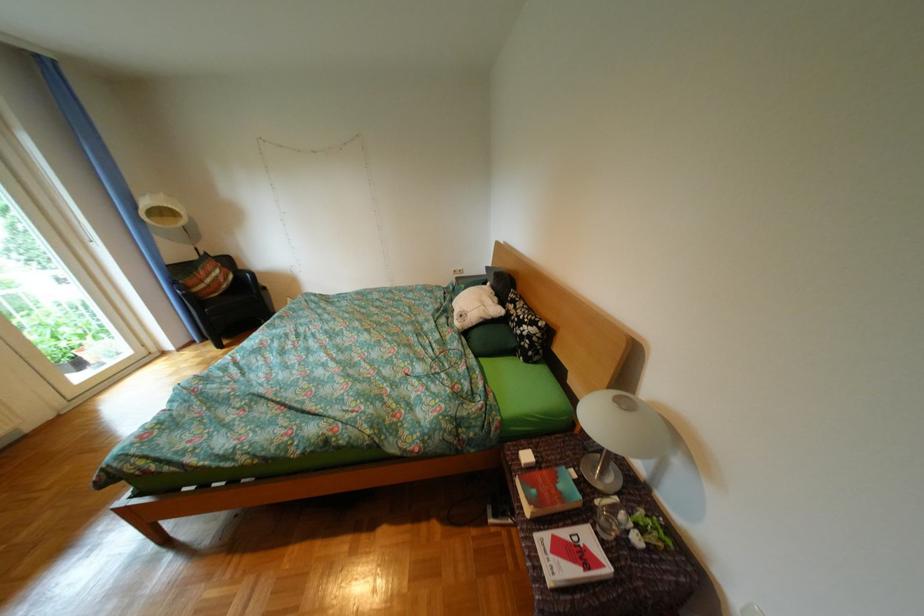
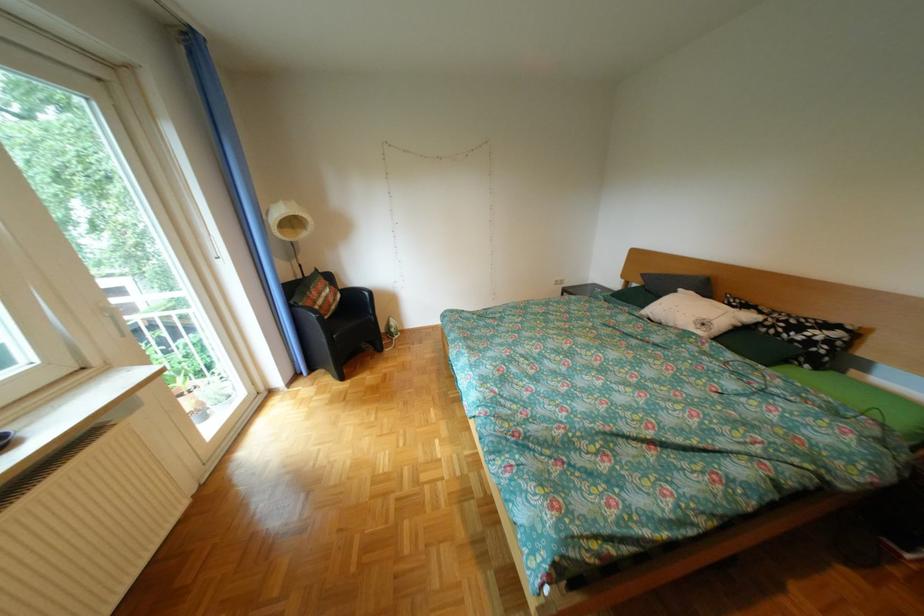
The point at (x=476, y=315) is marked in the first image. Where is the corresponding point in the second image?

(718, 325)